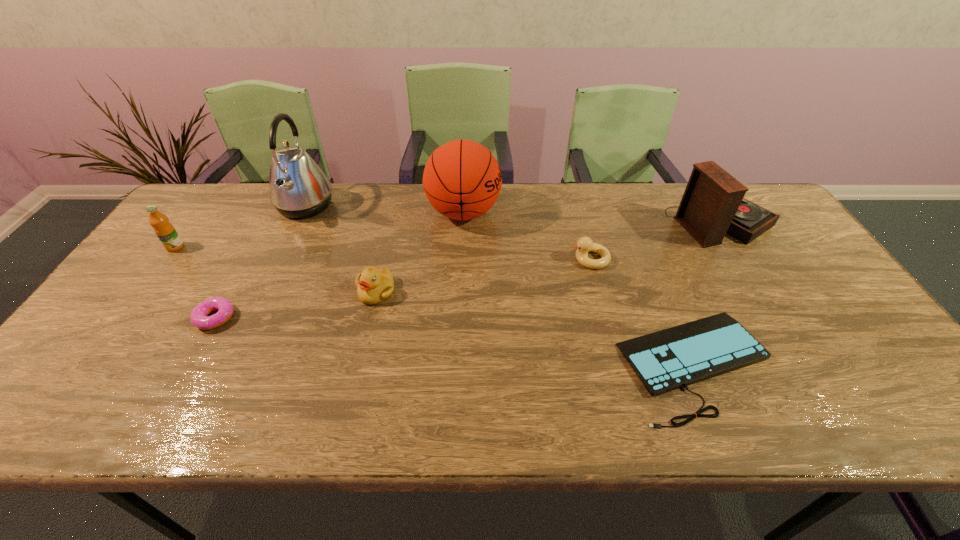
The image size is (960, 540). Find the location of `the tallest object`. the tallest object is located at coordinates (298, 188).

The width and height of the screenshot is (960, 540). I want to click on the seventh shortest object, so click(462, 180).

Find the location of `basketball`. basketball is located at coordinates (462, 180).

Where is `phonograph record`? This screenshot has height=540, width=960. phonograph record is located at coordinates (712, 204).

This screenshot has width=960, height=540. In order to click on orange juice in this screenshot , I will do `click(165, 231)`.

Find the location of a particular element. the fourth tallest object is located at coordinates (165, 231).

At what (x,y) coordinates should I click in order to perform the action: click on the fifth object from right to left. Please return your answer as a coordinate pair (x, y). The image size is (960, 540). Looking at the image, I should click on (374, 286).

Identify the location of the left duckling. This screenshot has width=960, height=540. (374, 286).

Find the location of a particular element. the right duckling is located at coordinates (584, 245).

This screenshot has height=540, width=960. I want to click on doughnut, so click(x=199, y=317).